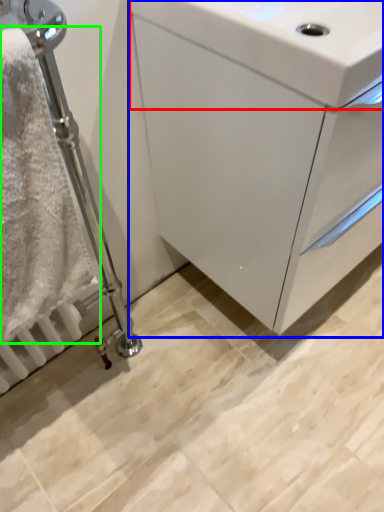
Question: Based on their relative distances, which object is nearer to sink (highlighted by a red box)? Choose from bathroom cabinet (highlighted by a blue box) and bath towel (highlighted by a green box).

Choices:
 (A) bathroom cabinet
 (B) bath towel

Answer: (A)